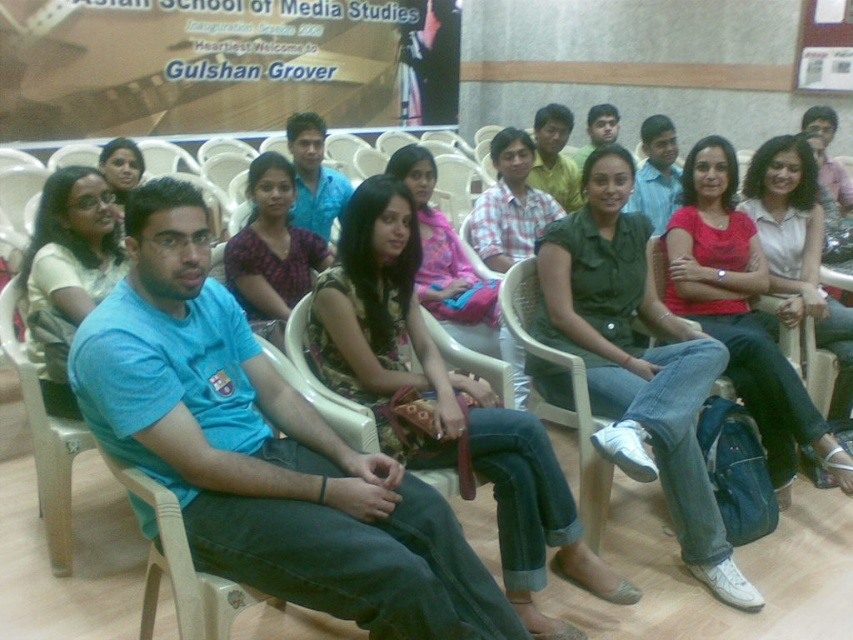
You are organizing a photo shoot and need to arrange two outfits in the auditorium scene. The outfits are the floral fabric dress at center and the printed cotton shirt at center. Which outfit takes up more space in the scene?

The floral fabric dress at center has a larger size compared to the printed cotton shirt at center, so it takes up more space in the scene.